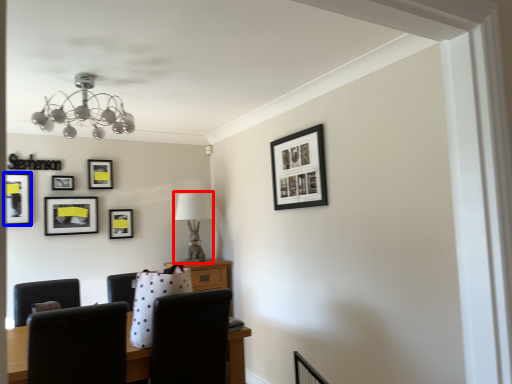
Question: Which point is closer to the camera, table lamp (highlighted by a red box) or picture frame (highlighted by a blue box)?

Choices:
 (A) table lamp
 (B) picture frame

Answer: (B)